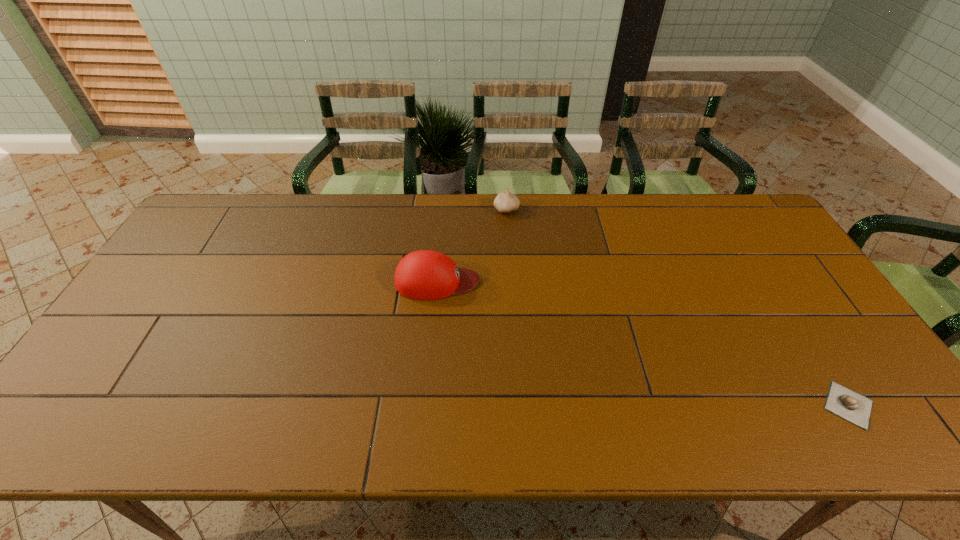
Locate which object ranks second in proximity to the second nearest object. Please provide its 2D coordinates. Your answer should be formatted as a tuple, i.e. [(x, y)], where the tuple contains the x and y coordinates of a point satisfying the conditions above.

[(841, 401)]

Where is `vacant point that satisfies the following two spatial constraints: 1. on the front side of the left garlic; 2. on the front-facing side of the tallest object`? The image size is (960, 540). vacant point that satisfies the following two spatial constraints: 1. on the front side of the left garlic; 2. on the front-facing side of the tallest object is located at coordinates (512, 281).

Find the location of a particular element. The width and height of the screenshot is (960, 540). free region that satisfies the following two spatial constraints: 1. on the front-facing side of the leftmost object; 2. on the back side of the nearer garlic is located at coordinates (425, 405).

This screenshot has width=960, height=540. I want to click on free space in the image that satisfies the following two spatial constraints: 1. on the front side of the farther garlic; 2. on the left side of the right garlic, so (x=520, y=405).

The image size is (960, 540). I want to click on vacant space that satisfies the following two spatial constraints: 1. on the front-facing side of the leftmost object; 2. on the left side of the shortest object, so click(425, 405).

Where is `free spot that satisfies the following two spatial constraints: 1. on the back side of the nearer garlic; 2. on the front-facing side of the second farthest object`? The width and height of the screenshot is (960, 540). free spot that satisfies the following two spatial constraints: 1. on the back side of the nearer garlic; 2. on the front-facing side of the second farthest object is located at coordinates (771, 281).

Identify the location of free location that satisfies the following two spatial constraints: 1. on the front-facing side of the nearest object; 2. on the right side of the leftmost object. Image resolution: width=960 pixels, height=540 pixels. (425, 405).